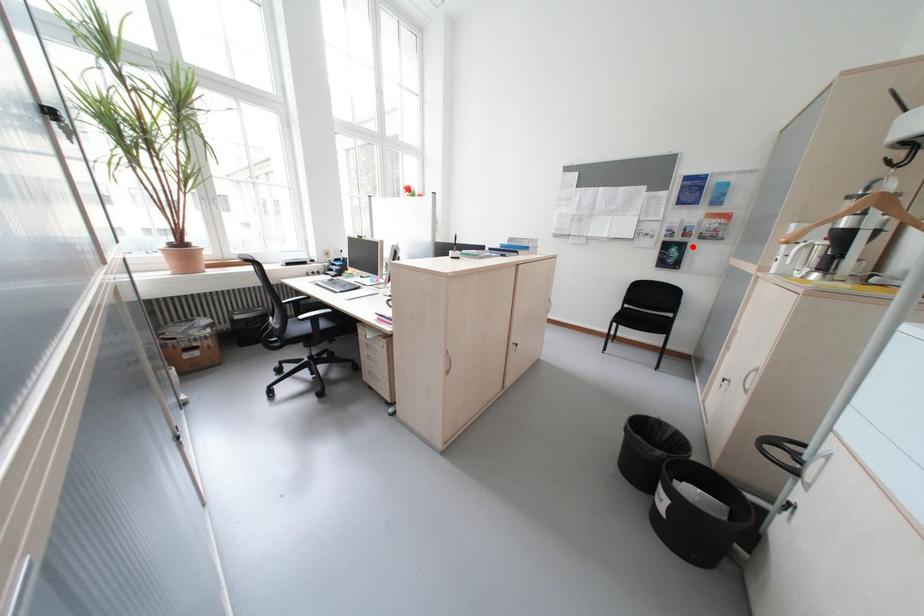
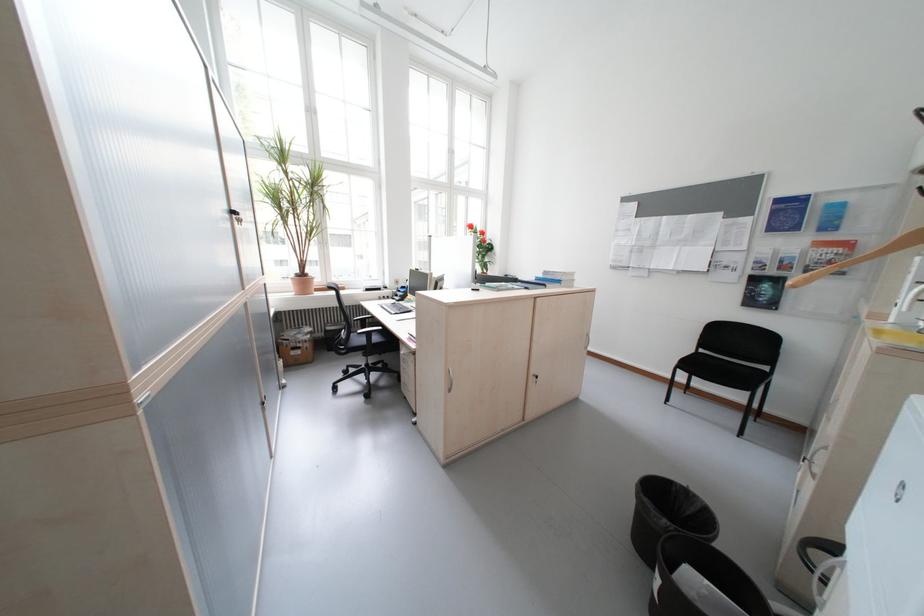
Question: A red point is marked in image1. In image2, is the corresponding 3D point closer to the camera or farther? Reply with the corresponding letter.

Choices:
 (A) The corresponding 3D point is closer.
 (B) The corresponding 3D point is farther.

Answer: (B)